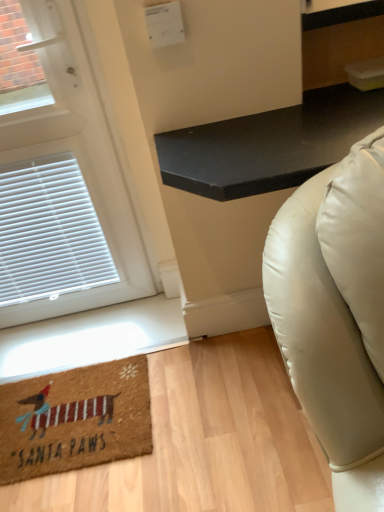
This screenshot has width=384, height=512. Describe the element at coordinates (62, 184) in the screenshot. I see `white matte door at upper left` at that location.

The image size is (384, 512). What do you see at coordinates (252, 191) in the screenshot? I see `black matte table at upper right` at bounding box center [252, 191].

At what (x,y) coordinates should I click in order to perform the action: click on white matte door at upper left. Please return your answer as a coordinate pair (x, y). The width and height of the screenshot is (384, 512). Looking at the image, I should click on (62, 184).

Who is taller, white matte door at upper left or brown coir mat at lower left?

Standing taller between the two is white matte door at upper left.

Is white matte door at upper left wider than brown coir mat at lower left?

In fact, white matte door at upper left might be narrower than brown coir mat at lower left.

Is the position of white matte door at upper left less distant than that of brown coir mat at lower left?

Yes.

Is white matte door at upper left not within brown coir mat at lower left?

Yes, white matte door at upper left is outside of brown coir mat at lower left.

Are white matte door at upper left and black matte table at upper right far apart?

No.

From a real-world perspective, does white matte door at upper left stand above black matte table at upper right?

Yes, from a real-world perspective, white matte door at upper left is above black matte table at upper right.

Consider the image. In terms of size, does white matte door at upper left appear bigger or smaller than black matte table at upper right?

Considering their sizes, white matte door at upper left takes up less space than black matte table at upper right.

Can you confirm if white matte door at upper left is taller than black matte table at upper right?

Indeed, white matte door at upper left has a greater height compared to black matte table at upper right.

Is brown coir mat at lower left not near black matte table at upper right?

They are positioned close to each other.

Can you confirm if brown coir mat at lower left is smaller than black matte table at upper right?

Yes, brown coir mat at lower left is smaller than black matte table at upper right.

How many degrees apart are the facing directions of black matte table at upper right and brown coir mat at lower left?

The facing directions of black matte table at upper right and brown coir mat at lower left are 0.097 degrees apart.

Would you say black matte table at upper right is outside brown coir mat at lower left?

Yes.

Is black matte table at upper right taller or shorter than brown coir mat at lower left?

Considering their sizes, black matte table at upper right has more height than brown coir mat at lower left.

Considering the positions of objects black matte table at upper right and brown coir mat at lower left in the image provided, who is more to the right, black matte table at upper right or brown coir mat at lower left?

black matte table at upper right is more to the right.

From a real-world perspective, is black matte table at upper right below white matte door at upper left?

Yes.

Consider the image. Looking at the image, does black matte table at upper right seem bigger or smaller compared to white matte door at upper left?

black matte table at upper right is bigger than white matte door at upper left.

Is black matte table at upper right oriented towards white matte door at upper left?

No, black matte table at upper right is not facing towards white matte door at upper left.

Does black matte table at upper right lie behind white matte door at upper left?

No, it is in front of white matte door at upper left.

Looking at the image, does brown coir mat at lower left seem bigger or smaller compared to white matte door at upper left?

Considering their sizes, brown coir mat at lower left takes up less space than white matte door at upper left.

Consider the image. From the image's perspective, which is below, brown coir mat at lower left or white matte door at upper left?

brown coir mat at lower left is shown below in the image.

Between brown coir mat at lower left and white matte door at upper left, which one appears on the left side from the viewer's perspective?

Positioned to the left is white matte door at upper left.

Is the position of brown coir mat at lower left more distant than that of white matte door at upper left?

Yes, it is.

The image size is (384, 512). In order to click on door that appears in front of the brown coir mat at lower left in this screenshot , I will do `click(62, 184)`.

The height and width of the screenshot is (512, 384). I want to click on door located above the black matte table at upper right (from the image's perspective), so click(x=62, y=184).

Considering their positions, is brown coir mat at lower left positioned closer to white matte door at upper left than black matte table at upper right?

brown coir mat at lower left.

In the scene shown: Looking at the image, which one is located closer to white matte door at upper left, black matte table at upper right or brown coir mat at lower left?

Among the two, brown coir mat at lower left is located nearer to white matte door at upper left.

Looking at the image, which one is located further to brown coir mat at lower left, black matte table at upper right or white matte door at upper left?

Based on the image, black matte table at upper right appears to be further to brown coir mat at lower left.

Looking at the image, which one is located closer to black matte table at upper right, white matte door at upper left or brown coir mat at lower left?

white matte door at upper left.

When comparing their distances from brown coir mat at lower left, does white matte door at upper left or black matte table at upper right seem closer?

The object closer to brown coir mat at lower left is white matte door at upper left.

Looking at the image, which one is located closer to black matte table at upper right, brown coir mat at lower left or white matte door at upper left?

white matte door at upper left is closer to black matte table at upper right.

The height and width of the screenshot is (512, 384). I want to click on mat between white matte door at upper left and black matte table at upper right from left to right, so click(x=75, y=419).